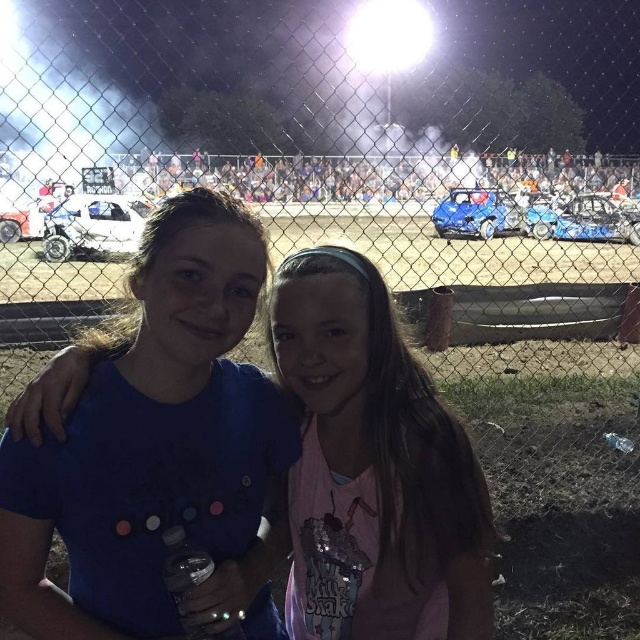
Question: Which of the following is the farthest from the observer?

Choices:
 (A) white matte car at center
 (B) matte white car at left

Answer: (B)

Question: In this image, where is pink fabric shirt at center located relative to matte white car at left?

Choices:
 (A) left
 (B) right

Answer: (B)

Question: Which of the following is the closest to the observer?

Choices:
 (A) (36, 228)
 (B) (65, 221)

Answer: (B)

Question: Which point is farther to the camera?

Choices:
 (A) white matte car at center
 (B) pink fabric shirt at center

Answer: (A)

Question: Where is pink fabric shirt at center located in relation to matte white car at left in the image?

Choices:
 (A) above
 (B) below

Answer: (B)

Question: Does shiny blue car at center have a smaller size compared to matte white car at left?

Choices:
 (A) no
 (B) yes

Answer: (A)